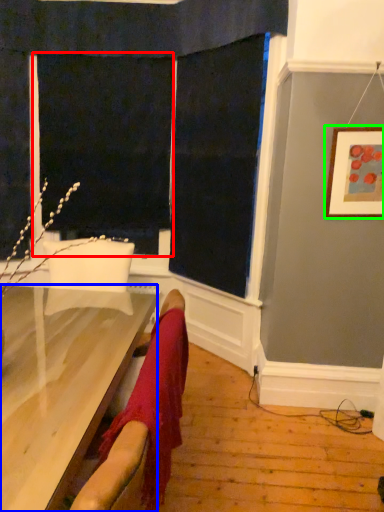
Question: Which object is the closest to the screen door (highlighted by a red box)? Choose among these: furniture (highlighted by a blue box) or picture frame (highlighted by a green box).

Choices:
 (A) furniture
 (B) picture frame

Answer: (B)